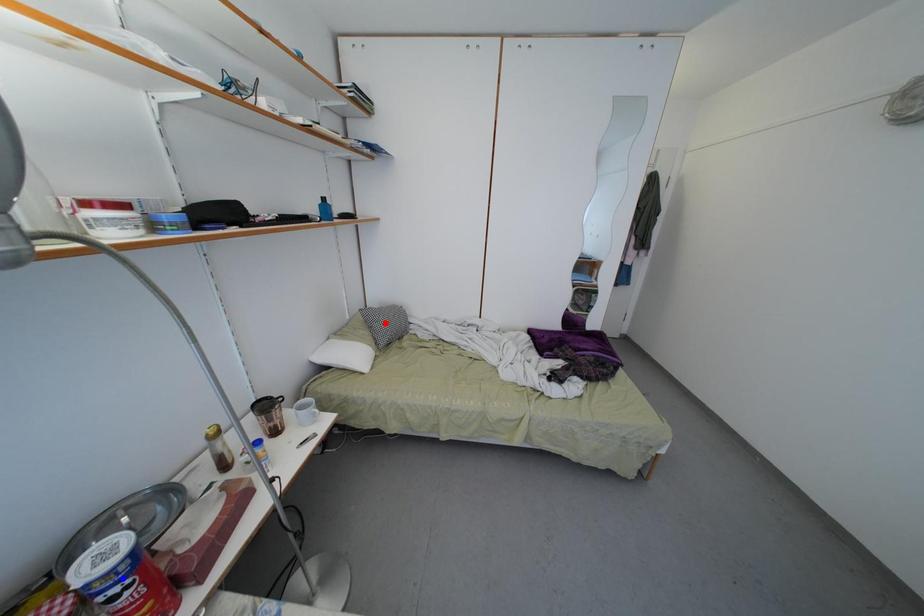
Question: Which of the two points in the image is closer to the camera?

Choices:
 (A) Blue point is closer.
 (B) Red point is closer.

Answer: (A)